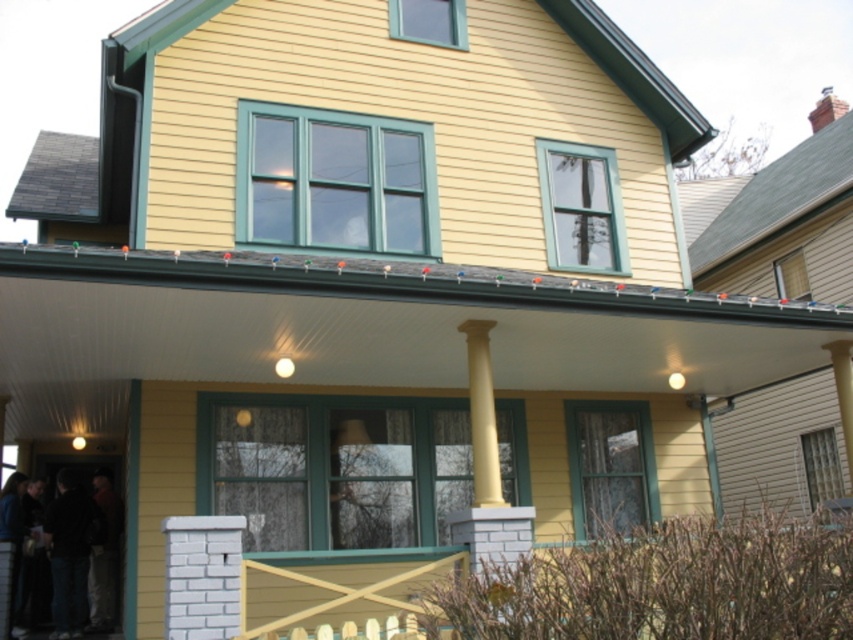
Question: Considering the real-world distances, which object is farthest from the yellow painted wood pillar at center?

Choices:
 (A) dark clothing at entrance
 (B) dark blue jeans at lower left
 (C) yellow smooth column at center

Answer: (B)

Question: Does dark blue jeans at lower left appear under yellow smooth column at center?

Choices:
 (A) yes
 (B) no

Answer: (A)

Question: Can you confirm if dark blue jeans at lower left is positioned to the right of dark clothing at entrance?

Choices:
 (A) no
 (B) yes

Answer: (B)

Question: Is dark clothing at entrance further to camera compared to yellow smooth column at center?

Choices:
 (A) yes
 (B) no

Answer: (A)

Question: Which object is positioned farthest from the dark blue jeans at lower left?

Choices:
 (A) dark clothing at entrance
 (B) yellow smooth column at center
 (C) yellow painted wood pillar at center

Answer: (C)

Question: Among these points, which one is farthest from the camera?

Choices:
 (A) (496, 496)
 (B) (836, 364)
 (C) (61, 600)

Answer: (C)